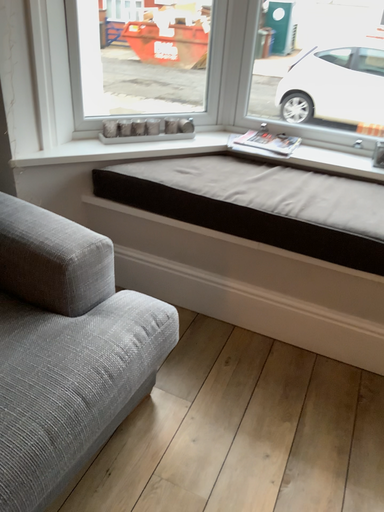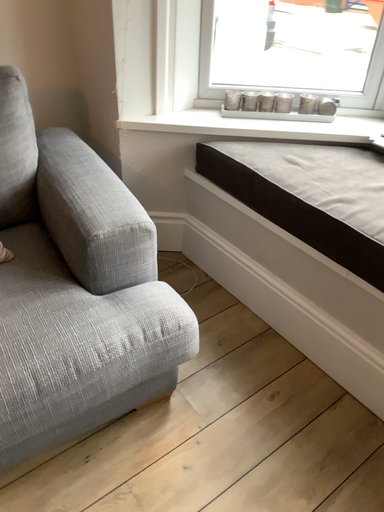
Question: Which way did the camera rotate in the video?

Choices:
 (A) rotated left
 (B) rotated right

Answer: (A)